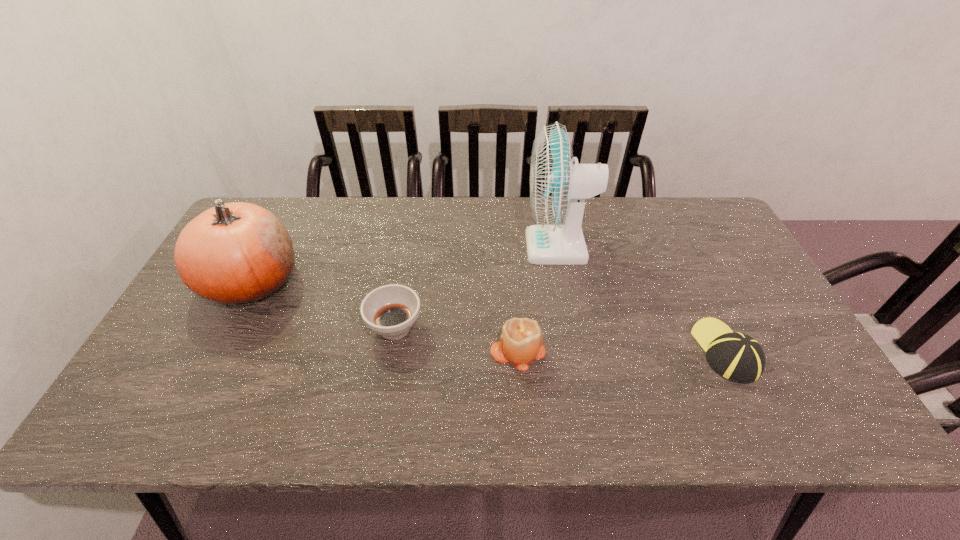
Where is `fan`? This screenshot has height=540, width=960. fan is located at coordinates (558, 188).

Locate an element on the screen. The image size is (960, 540). the second tallest object is located at coordinates (233, 253).

You are a GUI agent. You are given a task and a screenshot of the screen. Output one action in this format:
    pyautogui.click(x=<x>, y=<y>)
    Task: Click on the pumpkin
    Image resolution: width=960 pixels, height=540 pixels.
    Given the screenshot: What is the action you would take?
    pyautogui.click(x=233, y=253)

Where is `the third tallest object`? the third tallest object is located at coordinates (521, 340).

Identify the location of the second object from left to right. This screenshot has height=540, width=960. (391, 310).

At what (x,y) coordinates should I click in order to perform the action: click on baseball cap. Please return your answer as a coordinate pair (x, y). This screenshot has width=960, height=540. Looking at the image, I should click on (737, 357).

The width and height of the screenshot is (960, 540). Find the location of `vacant space located in front of the tallest object to face the airflow`. vacant space located in front of the tallest object to face the airflow is located at coordinates (419, 247).

Locate an element on the screen. vacant area situated 0.060m in front of the tallest object to face the airflow is located at coordinates (506, 247).

Where is `free space located in front of the tallest object to face the airflow`? This screenshot has height=540, width=960. free space located in front of the tallest object to face the airflow is located at coordinates (474, 247).

Find the location of `vacant space situated 0.170m on the right of the fourth shortest object`. vacant space situated 0.170m on the right of the fourth shortest object is located at coordinates (360, 280).